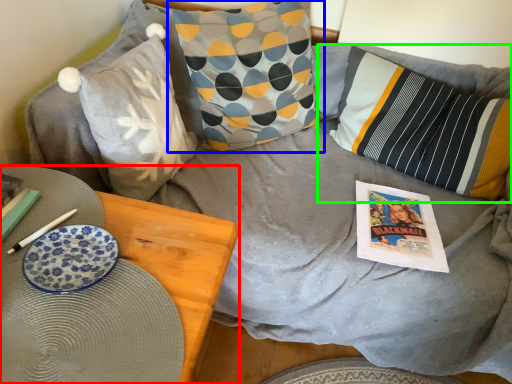
Question: Based on their relative distances, which object is nearer to furniture (highlighted by a red box)? Choose from pillow (highlighted by a blue box) and pillow (highlighted by a green box).

Choices:
 (A) pillow
 (B) pillow

Answer: (A)